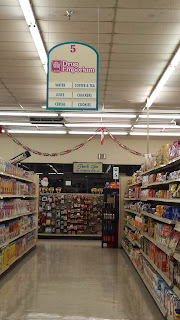
Identify the location of light source. Image resolution: width=180 pixels, height=320 pixels. (167, 73), (38, 45).